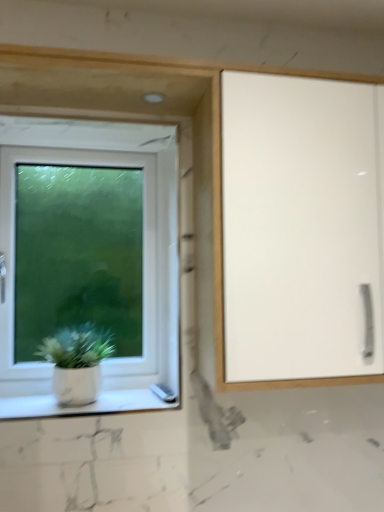
Question: Is white matte pot at lower left aimed at white glossy cabinet at right?

Choices:
 (A) no
 (B) yes

Answer: (A)

Question: Is white matte pot at lower left shorter than white glossy cabinet at right?

Choices:
 (A) yes
 (B) no

Answer: (A)

Question: From a real-world perspective, does white matte pot at lower left sit lower than white glossy cabinet at right?

Choices:
 (A) yes
 (B) no

Answer: (A)

Question: Considering the relative sizes of white matte pot at lower left and white glossy cabinet at right in the image provided, is white matte pot at lower left bigger than white glossy cabinet at right?

Choices:
 (A) no
 (B) yes

Answer: (A)

Question: Is white matte pot at lower left not within white glossy cabinet at right?

Choices:
 (A) yes
 (B) no

Answer: (A)

Question: From a real-world perspective, relative to white marble window sill at lower left, is white glossy cabinet at right vertically above or below?

Choices:
 (A) below
 (B) above

Answer: (B)

Question: Is white glossy cabinet at right inside or outside of white marble window sill at lower left?

Choices:
 (A) outside
 (B) inside

Answer: (A)

Question: In the image, is white glossy cabinet at right positioned in front of or behind white marble window sill at lower left?

Choices:
 (A) behind
 (B) front

Answer: (B)

Question: Considering the positions of white glossy cabinet at right and white marble window sill at lower left in the image, is white glossy cabinet at right wider or thinner than white marble window sill at lower left?

Choices:
 (A) thin
 (B) wide

Answer: (B)

Question: Looking at the image, does white marble window sill at lower left seem bigger or smaller compared to white plastic window at left?

Choices:
 (A) big
 (B) small

Answer: (B)

Question: From a real-world perspective, is white marble window sill at lower left above or below white plastic window at left?

Choices:
 (A) above
 (B) below

Answer: (B)

Question: Choose the correct answer: Is white marble window sill at lower left inside white plastic window at left or outside it?

Choices:
 (A) inside
 (B) outside

Answer: (B)

Question: From the image's perspective, is white marble window sill at lower left located above or below white plastic window at left?

Choices:
 (A) above
 (B) below

Answer: (B)

Question: From their relative heights in the image, would you say white matte pot at lower left is taller or shorter than white plastic window at left?

Choices:
 (A) short
 (B) tall

Answer: (A)

Question: From the image's perspective, is white matte pot at lower left above or below white plastic window at left?

Choices:
 (A) above
 (B) below

Answer: (B)